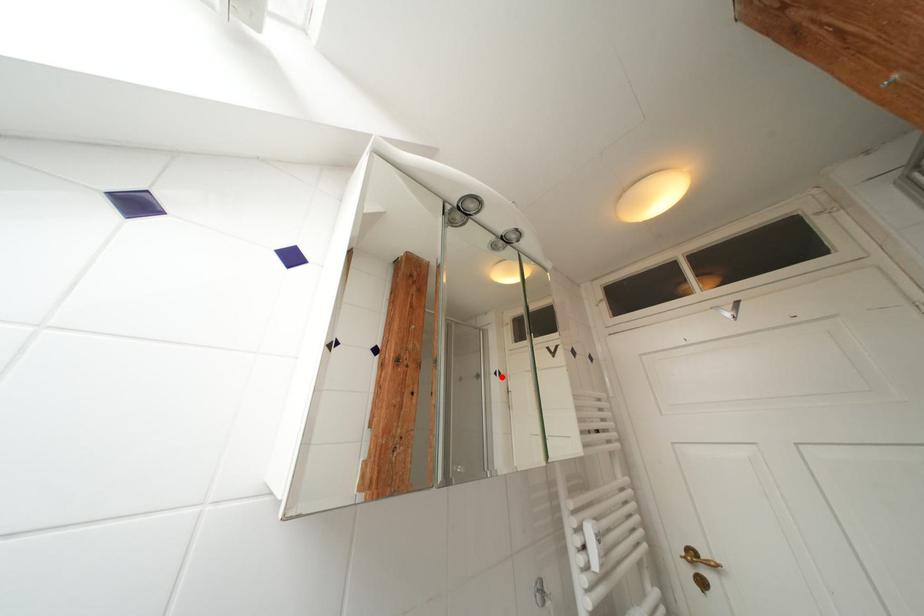
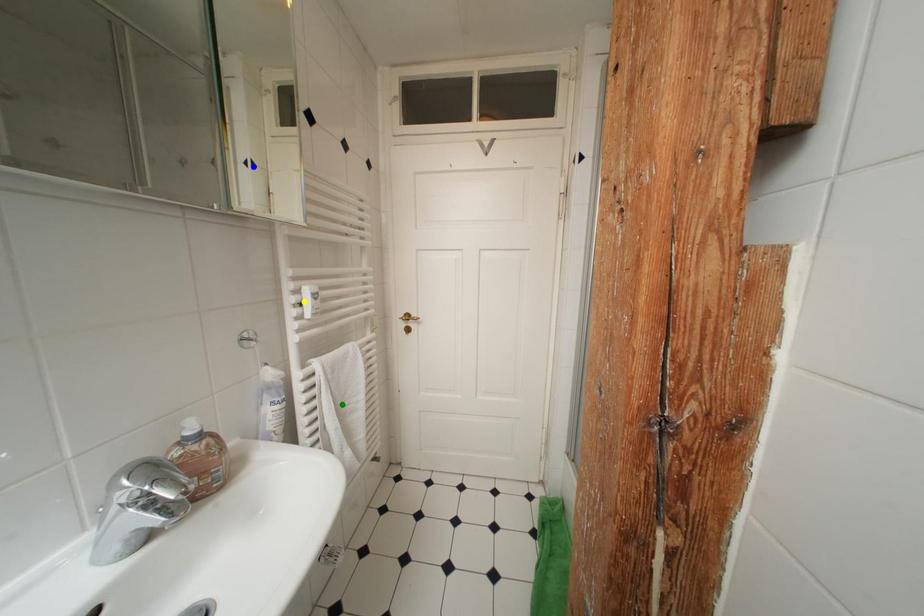
Question: I am providing you with two images of the same scene from different viewpoints. A red point is marked on the first image. You are given multiple points on the second image. Can you choose the point in image 2 that corresponds to the point in image 1?

Choices:
 (A) yellow point
 (B) green point
 (C) blue point

Answer: (C)